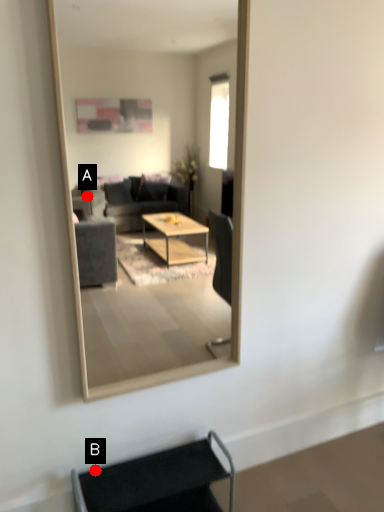
Question: Two points are circled on the image, labeled by A and B beside each circle. Which point is closer to the camera taking this photo?

Choices:
 (A) A is closer
 (B) B is closer

Answer: (B)